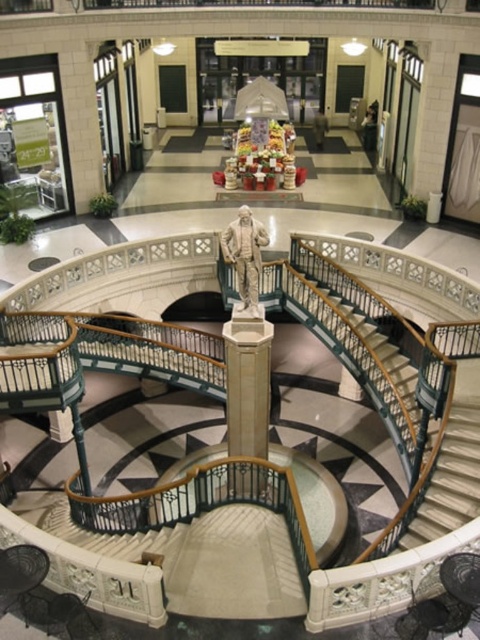
Who is higher up, white marble column at center or white marble statue at center?

white marble statue at center is above.

Is white marble column at center below white marble statue at center?

Correct, white marble column at center is located below white marble statue at center.

Locate an element on the screen. white marble column at center is located at coordinates (248, 397).